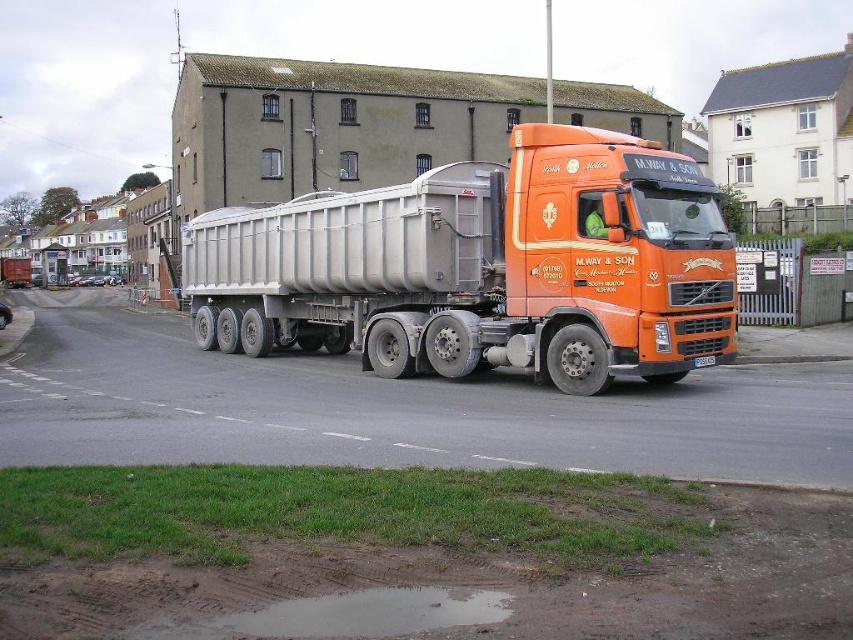
Question: Which object appears farthest from the camera in this image?

Choices:
 (A) muddy water at lower center
 (B) orange matte truck at center

Answer: (B)

Question: Does orange matte truck at center appear over muddy water at lower center?

Choices:
 (A) no
 (B) yes

Answer: (B)

Question: Is orange matte truck at center further to the viewer compared to muddy water at lower center?

Choices:
 (A) yes
 (B) no

Answer: (A)

Question: Can you confirm if orange matte truck at center is smaller than muddy water at lower center?

Choices:
 (A) no
 (B) yes

Answer: (A)